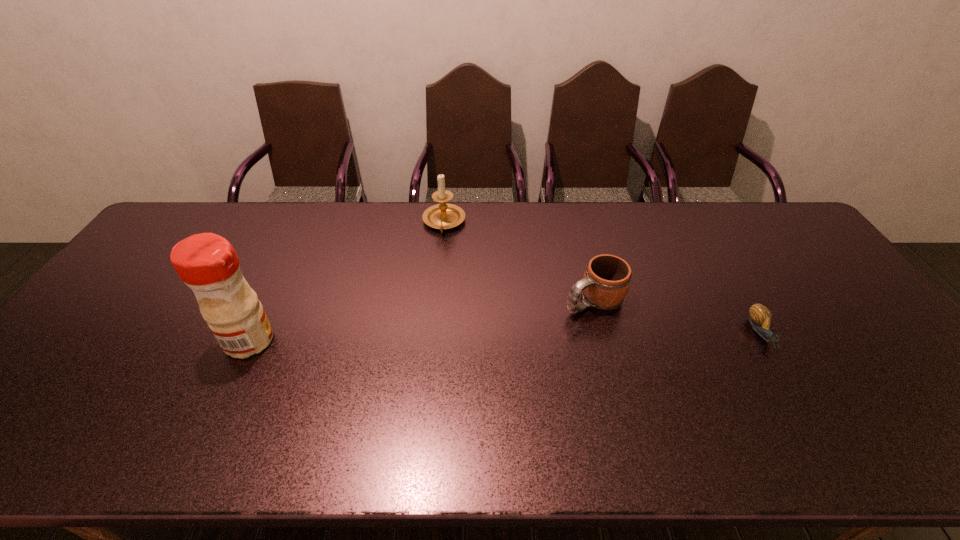
At what (x,y) coordinates should I click in order to perform the action: click on free space located on the side of the third object from left to right with the handle. Please return your answer as a coordinate pair (x, y). The width and height of the screenshot is (960, 540). Looking at the image, I should click on (450, 379).

Locate an element on the screen. The image size is (960, 540). free space located 0.370m on the side of the third object from left to right with the handle is located at coordinates (457, 375).

Locate an element on the screen. vacant space positioned on the side of the third object from left to right with the handle is located at coordinates (454, 377).

Locate an element on the screen. Image resolution: width=960 pixels, height=540 pixels. vacant space located with a handle on the side of the farthest object is located at coordinates (442, 259).

Find the location of a particular element. The height and width of the screenshot is (540, 960). free point located 0.180m with a handle on the side of the farthest object is located at coordinates (441, 276).

The width and height of the screenshot is (960, 540). In order to click on vacant space located with a handle on the side of the farthest object in this screenshot , I will do `click(438, 334)`.

This screenshot has height=540, width=960. I want to click on object that is at the far edge, so click(x=441, y=216).

Where is `free space at the far edge`? The width and height of the screenshot is (960, 540). free space at the far edge is located at coordinates point(405,204).

Find the location of a particular element. The width and height of the screenshot is (960, 540). free spot at the near edge of the desktop is located at coordinates (280, 392).

Locate an element on the screen. The image size is (960, 540). free space at the right edge of the desktop is located at coordinates (845, 319).